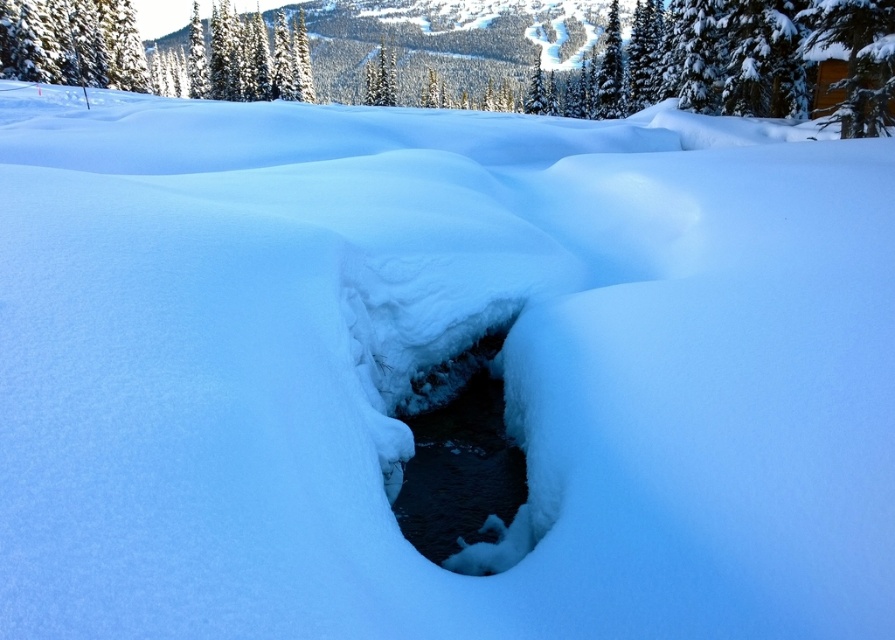
Does point (401, 488) come closer to viewer compared to point (78, 17)?

Yes.

Is clear ice hole at center to the right of green textured tree at upper left from the viewer's perspective?

Indeed, clear ice hole at center is positioned on the right side of green textured tree at upper left.

You are a GUI agent. You are given a task and a screenshot of the screen. Output one action in this format:
    pyautogui.click(x=<x>, y=<y>)
    Task: Click on the clear ice hole at center
    The height and width of the screenshot is (640, 895).
    Given the screenshot: What is the action you would take?
    pyautogui.click(x=465, y=465)